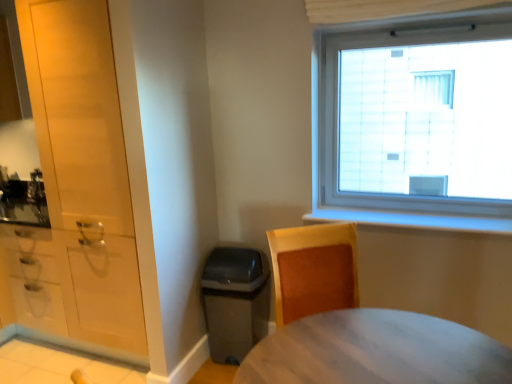
Where is `matte white cabinet at left, the 2th cabinetry from the left`? This screenshot has height=384, width=512. matte white cabinet at left, the 2th cabinetry from the left is located at coordinates (70, 191).

Describe the element at coordinates (77, 287) in the screenshot. I see `matte white cabinets at left, acting as the 1th cabinetry starting from the left` at that location.

Image resolution: width=512 pixels, height=384 pixels. I want to click on matte white cabinet at left, the 2th cabinetry from the left, so click(70, 191).

Is wooden desk at lower right oriented towards matte white cabinets at left, which ranks as the 2th cabinetry in right-to-left order?

No, wooden desk at lower right is not aimed at matte white cabinets at left, which ranks as the 2th cabinetry in right-to-left order.

Looking at this image, is wooden desk at lower right far away from matte white cabinets at left, which ranks as the 2th cabinetry in right-to-left order?

Yes, wooden desk at lower right and matte white cabinets at left, which ranks as the 2th cabinetry in right-to-left order, are quite far apart.

From a real-world perspective, is wooden desk at lower right located beneath matte white cabinets at left, which ranks as the 2th cabinetry in right-to-left order?

Incorrect, from a real-world perspective, wooden desk at lower right is higher than matte white cabinets at left, which ranks as the 2th cabinetry in right-to-left order.

Which object is closer to the camera taking this photo, wooden desk at lower right or matte white cabinets at left, which ranks as the 2th cabinetry in right-to-left order?

wooden desk at lower right is more forward.

Is wooden desk at lower right at the right side of matte white cabinet at left, the 2th cabinetry from the left?

Yes.

Is matte white cabinet at left, acting as the 1th cabinetry starting from the right, at the back of wooden desk at lower right?

No, wooden desk at lower right is not facing the opposite direction of matte white cabinet at left, acting as the 1th cabinetry starting from the right.

Between wooden desk at lower right and matte white cabinet at left, acting as the 1th cabinetry starting from the right, which one has larger size?

matte white cabinet at left, acting as the 1th cabinetry starting from the right.

Considering the sizes of wooden desk at lower right and matte white cabinet at left, the 2th cabinetry from the left, in the image, is wooden desk at lower right taller or shorter than matte white cabinet at left, the 2th cabinetry from the left,?

wooden desk at lower right is shorter than matte white cabinet at left, the 2th cabinetry from the left.

Does point (110, 340) appear closer or farther from the camera than point (42, 150)?

Point (110, 340).

Can you confirm if matte white cabinets at left, which ranks as the 2th cabinetry in right-to-left order, is wider than matte white cabinet at left, the 2th cabinetry from the left?

No, matte white cabinets at left, which ranks as the 2th cabinetry in right-to-left order, is not wider than matte white cabinet at left, the 2th cabinetry from the left.

Image resolution: width=512 pixels, height=384 pixels. I want to click on cabinetry directly beneath the matte white cabinet at left, the 2th cabinetry from the left (from a real-world perspective), so click(x=77, y=287).

Which of these two, matte white cabinets at left, acting as the 1th cabinetry starting from the left, or matte white cabinet at left, acting as the 1th cabinetry starting from the right, is smaller?

With smaller size is matte white cabinets at left, acting as the 1th cabinetry starting from the left.

Is matte white cabinet at left, the 2th cabinetry from the left, facing away from matte white cabinets at left, which ranks as the 2th cabinetry in right-to-left order?

No, matte white cabinets at left, which ranks as the 2th cabinetry in right-to-left order, is not at the back of matte white cabinet at left, the 2th cabinetry from the left.

Is matte white cabinet at left, acting as the 1th cabinetry starting from the right, shorter than matte white cabinets at left, which ranks as the 2th cabinetry in right-to-left order?

In fact, matte white cabinet at left, acting as the 1th cabinetry starting from the right, may be taller than matte white cabinets at left, which ranks as the 2th cabinetry in right-to-left order.

Does point (50, 95) come behind point (52, 325)?

No, (50, 95) is in front of (52, 325).

From the image's perspective, is matte white cabinets at left, acting as the 1th cabinetry starting from the left, below wooden desk at lower right?

No.

Do you think matte white cabinets at left, acting as the 1th cabinetry starting from the left, is within wooden desk at lower right, or outside of it?

matte white cabinets at left, acting as the 1th cabinetry starting from the left, is located beyond the bounds of wooden desk at lower right.

Which object is positioned more to the left, matte white cabinets at left, which ranks as the 2th cabinetry in right-to-left order, or wooden desk at lower right?

matte white cabinets at left, which ranks as the 2th cabinetry in right-to-left order.

From a real-world perspective, between matte white cabinet at left, acting as the 1th cabinetry starting from the right, and wooden desk at lower right, who is vertically lower?

wooden desk at lower right.

Is matte white cabinet at left, acting as the 1th cabinetry starting from the right, turned away from wooden desk at lower right?

No, matte white cabinet at left, acting as the 1th cabinetry starting from the right, is not facing the opposite direction of wooden desk at lower right.

Which is more to the left, matte white cabinet at left, acting as the 1th cabinetry starting from the right, or wooden desk at lower right?

From the viewer's perspective, matte white cabinet at left, acting as the 1th cabinetry starting from the right, appears more on the left side.

I want to click on the 2nd cabinetry to the left of the wooden desk at lower right, starting your count from the anchor, so click(x=77, y=287).

The height and width of the screenshot is (384, 512). There is a wooden desk at lower right. Find the location of `the 2nd cabinetry above it (from the image's perspective)`. the 2nd cabinetry above it (from the image's perspective) is located at coordinates [x=70, y=191].

From the image, which object appears to be nearer to matte white cabinet at left, the 2th cabinetry from the left, matte white cabinets at left, which ranks as the 2th cabinetry in right-to-left order, or wooden desk at lower right?

matte white cabinets at left, which ranks as the 2th cabinetry in right-to-left order.

Estimate the real-world distances between objects in this image. Which object is further from matte white cabinets at left, acting as the 1th cabinetry starting from the left, wooden desk at lower right or matte white cabinet at left, the 2th cabinetry from the left?

The object further to matte white cabinets at left, acting as the 1th cabinetry starting from the left, is wooden desk at lower right.

Considering their positions, is matte white cabinet at left, acting as the 1th cabinetry starting from the right, positioned closer to wooden desk at lower right than matte white cabinets at left, which ranks as the 2th cabinetry in right-to-left order?

matte white cabinets at left, which ranks as the 2th cabinetry in right-to-left order, is positioned closer to the anchor wooden desk at lower right.

Looking at the image, which one is located further to matte white cabinets at left, acting as the 1th cabinetry starting from the left, matte white cabinet at left, the 2th cabinetry from the left, or wooden desk at lower right?

The object further to matte white cabinets at left, acting as the 1th cabinetry starting from the left, is wooden desk at lower right.

Considering their positions, is matte white cabinets at left, which ranks as the 2th cabinetry in right-to-left order, positioned further to wooden desk at lower right than matte white cabinet at left, acting as the 1th cabinetry starting from the right?

matte white cabinet at left, acting as the 1th cabinetry starting from the right, is positioned further to the anchor wooden desk at lower right.

When comparing their distances from matte white cabinet at left, acting as the 1th cabinetry starting from the right, does wooden desk at lower right or matte white cabinets at left, which ranks as the 2th cabinetry in right-to-left order, seem closer?

matte white cabinets at left, which ranks as the 2th cabinetry in right-to-left order, is closer to matte white cabinet at left, acting as the 1th cabinetry starting from the right.

Identify the location of cabinetry situated between matte white cabinets at left, which ranks as the 2th cabinetry in right-to-left order, and wooden desk at lower right from left to right. The height and width of the screenshot is (384, 512). (70, 191).